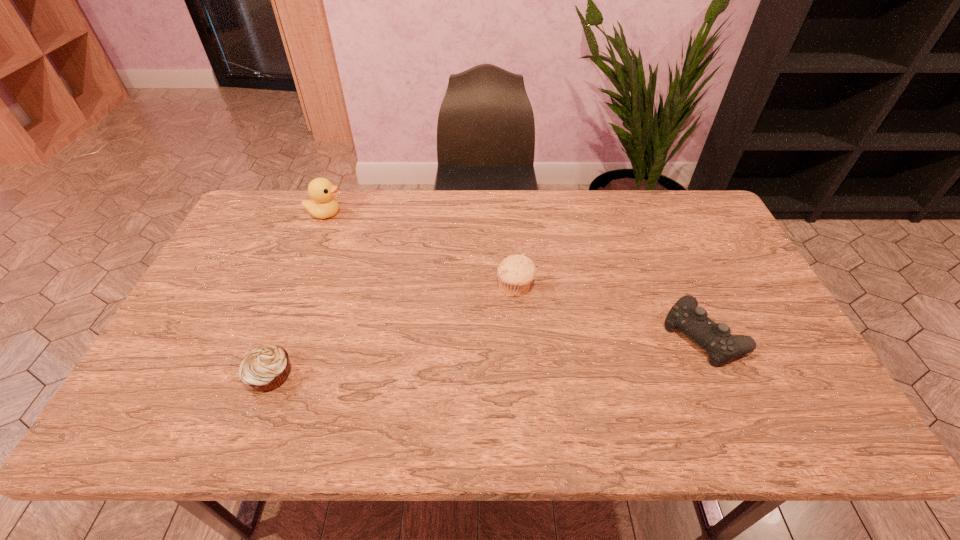
Identify the location of the farthest object. (323, 205).

At what (x,y) coordinates should I click in order to perform the action: click on duck. Please return your answer as a coordinate pair (x, y). Looking at the image, I should click on (323, 205).

You are a GUI agent. You are given a task and a screenshot of the screen. Output one action in this format:
    pyautogui.click(x=<x>, y=<y>)
    Task: Click on the right muffin
    
    Given the screenshot: What is the action you would take?
    pyautogui.click(x=516, y=272)

Find the location of a particular element. the farther muffin is located at coordinates (516, 272).

You are a GUI agent. You are given a task and a screenshot of the screen. Output one action in this format:
    pyautogui.click(x=<x>, y=<y>)
    Task: Click on the nearer muffin
    The height and width of the screenshot is (540, 960).
    Given the screenshot: What is the action you would take?
    pyautogui.click(x=265, y=368)

Locate an element on the screen. the left muffin is located at coordinates (265, 368).

Where is `the rightmost object`? the rightmost object is located at coordinates (715, 338).

Where is `free space located 0.310m on the face of the duck`? The height and width of the screenshot is (540, 960). free space located 0.310m on the face of the duck is located at coordinates (436, 213).

Identify the location of vacant position located on the back of the third object from left to right. (513, 254).

You are a GUI agent. You are given a task and a screenshot of the screen. Output one action in this format:
    pyautogui.click(x=<x>, y=<y>)
    Task: Click on the vacant space located on the left of the shorter muffin
    
    Given the screenshot: What is the action you would take?
    pyautogui.click(x=215, y=376)